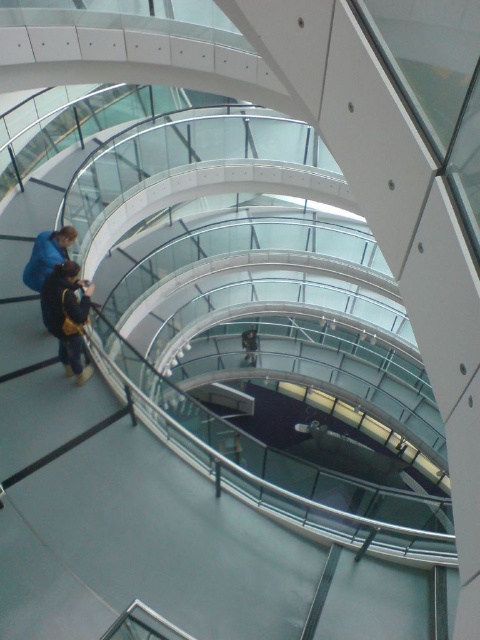
Question: Which point is farther to the camera?

Choices:
 (A) (248, 339)
 (B) (78, 369)

Answer: (A)

Question: Is dark brown leather jacket at lower left to the left of black fabric person at center from the viewer's perspective?

Choices:
 (A) yes
 (B) no

Answer: (A)

Question: Is the position of dark brown leather jacket at lower left less distant than that of black fabric person at center?

Choices:
 (A) yes
 (B) no

Answer: (A)

Question: Is dark brown leather jacket at lower left positioned in front of black fabric person at center?

Choices:
 (A) yes
 (B) no

Answer: (A)